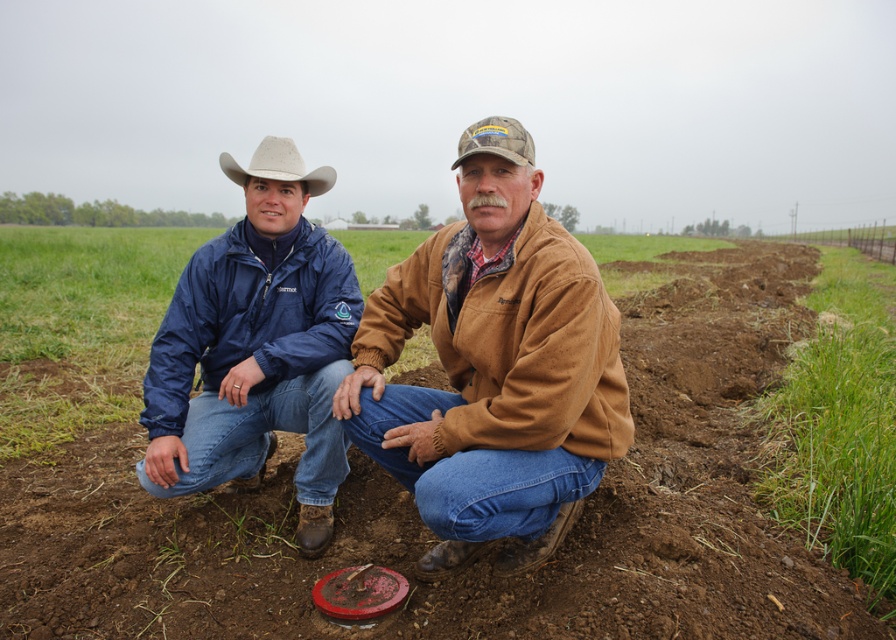
Question: Can you confirm if matte blue jacket at center is wider than camo fabric cowboy hat at center?

Choices:
 (A) yes
 (B) no

Answer: (B)

Question: Among these objects, which one is nearest to the camera?

Choices:
 (A) brown suede jacket at center
 (B) camo fabric cowboy hat at center
 (C) white felt cowboy hat at upper left
 (D) dirt at center

Answer: (A)

Question: Which object is positioned farthest from the brown suede jacket at center?

Choices:
 (A) dirt at center
 (B) white felt cowboy hat at upper left

Answer: (A)

Question: Can you confirm if dirt at center is wider than matte blue jacket at center?

Choices:
 (A) yes
 (B) no

Answer: (A)

Question: Does matte blue jacket at center appear on the left side of white felt cowboy hat at upper left?

Choices:
 (A) no
 (B) yes

Answer: (B)

Question: Which point is farther to the camera?

Choices:
 (A) (309, 188)
 (B) (242, 372)

Answer: (A)